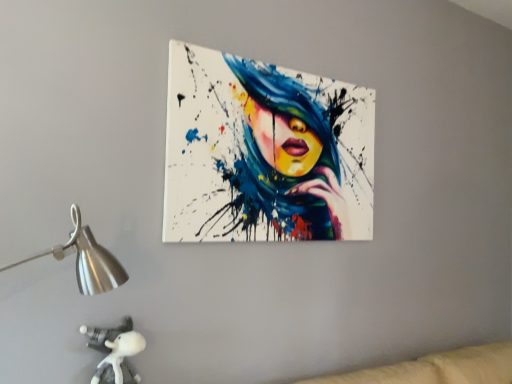
Describe the element at coordinates (115, 351) in the screenshot. I see `white matte figurine at lower left` at that location.

Where is `white matte figurine at lower left`? The height and width of the screenshot is (384, 512). white matte figurine at lower left is located at coordinates (115, 351).

The height and width of the screenshot is (384, 512). In order to click on white matte figurine at lower left in this screenshot , I will do `click(115, 351)`.